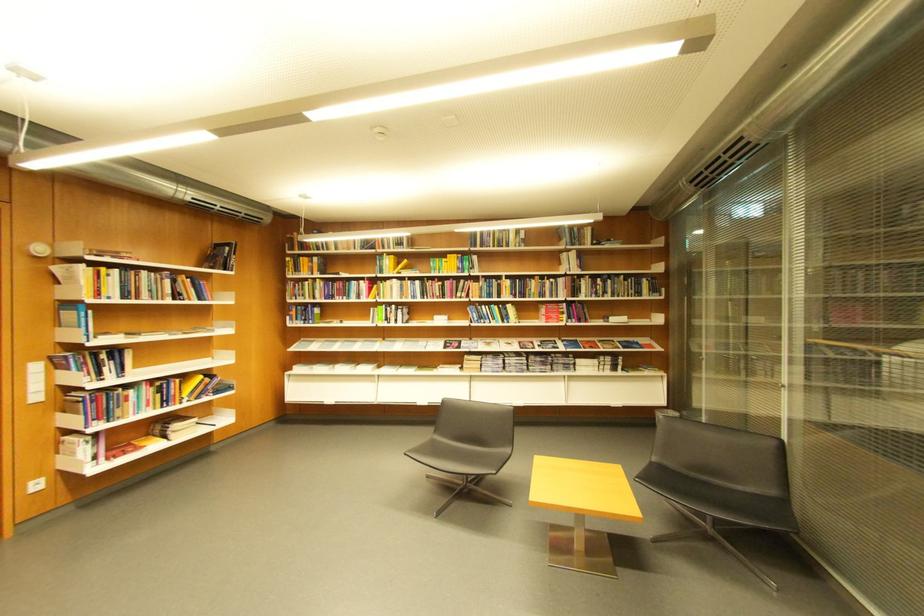
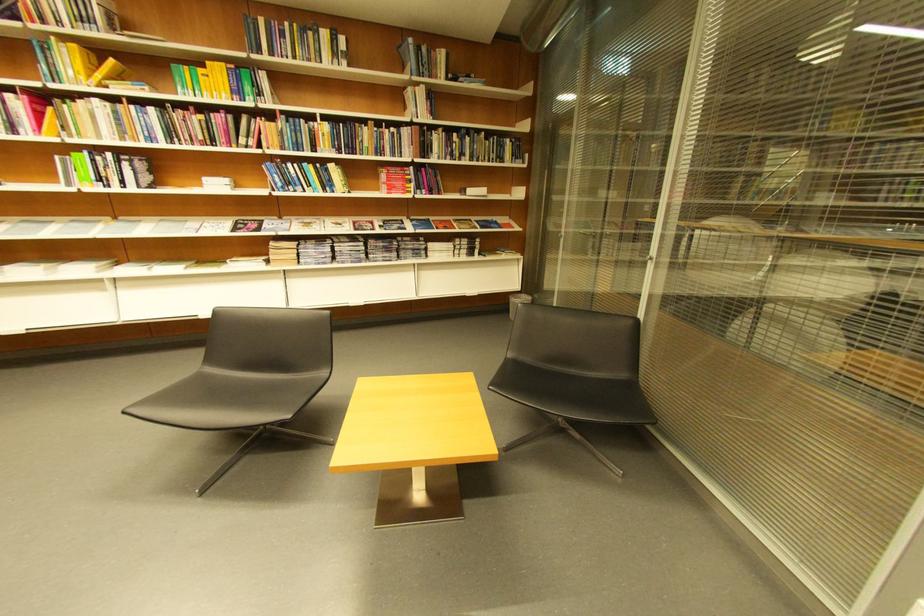
Where in the second image is the point corresponding to [676,411] from the first image?

(529, 297)